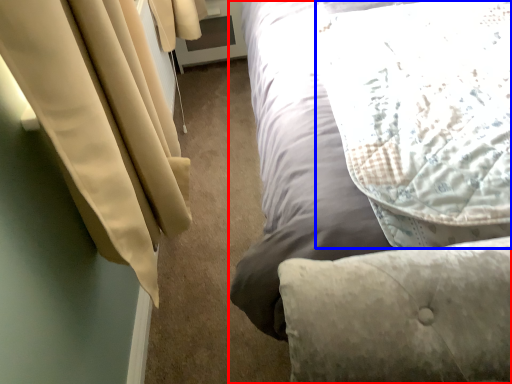
Question: Which point is further to the camera, bed (highlighted by a red box) or pillow (highlighted by a blue box)?

Choices:
 (A) bed
 (B) pillow

Answer: (B)